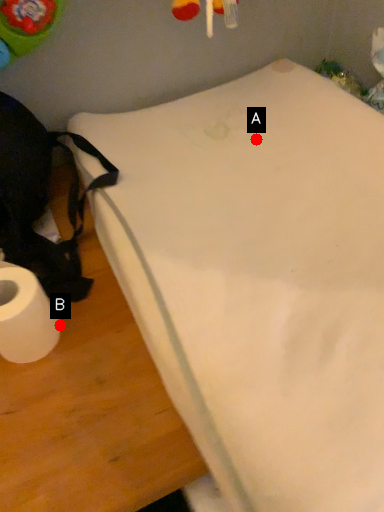
Question: Two points are circled on the image, labeled by A and B beside each circle. Which point appears closest to the camera in this image?

Choices:
 (A) A is closer
 (B) B is closer

Answer: (B)